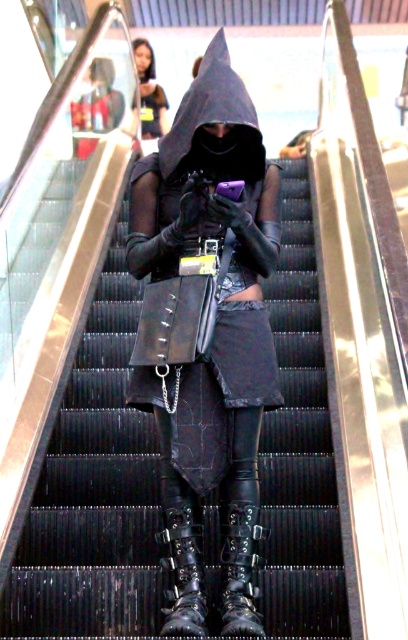
You are an observer standing directly in front of the person on the escalator. You notice a point marked at coordinates (183, 573). Which object from the scene is located at this point?

The point at coordinates (183, 573) marks the location of the leather black boots at lower center.